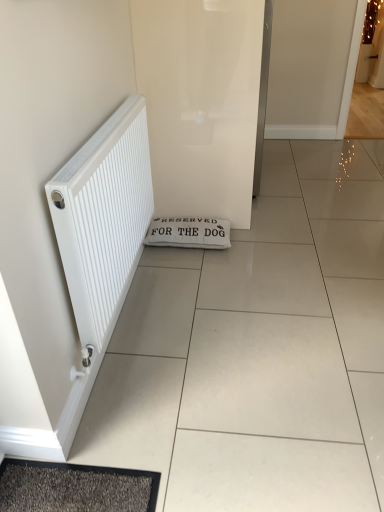
The image size is (384, 512). I want to click on white glossy screen door at center, so click(200, 102).

At what (x,y) coordinates should I click in order to perform the action: click on white glossy screen door at center. Please return your answer as a coordinate pair (x, y). Looking at the image, I should click on (200, 102).

From the picture: Which is in front, white glossy screen door at center or white matte radiator at left?

white matte radiator at left is in front.

Is white glossy screen door at center oriented towards white matte radiator at left?

No, white glossy screen door at center is not facing towards white matte radiator at left.

Can you tell me how much white glossy screen door at center and white matte radiator at left differ in facing direction?

white glossy screen door at center and white matte radiator at left are facing 0.27 degrees away from each other.

What's the angular difference between white fabric doormat at center and white matte radiator at left's facing directions?

89.7 degrees.

Is white matte radiator at left a part of white fabric doormat at center?

That's incorrect, white matte radiator at left is not inside white fabric doormat at center.

Where is `doormat behind the white matte radiator at left`? This screenshot has width=384, height=512. doormat behind the white matte radiator at left is located at coordinates tap(189, 233).

From the image's perspective, who appears lower, white matte radiator at left or white glossy screen door at center?

white matte radiator at left.

Is white matte radiator at left positioned beyond the bounds of white glossy screen door at center?

white matte radiator at left lies outside white glossy screen door at center's area.

What's the angular difference between white matte radiator at left and white glossy screen door at center's facing directions?

There is a 0.27-degree angle between the facing directions of white matte radiator at left and white glossy screen door at center.

Is white matte radiator at left directly adjacent to white glossy screen door at center?

No, white matte radiator at left is not with white glossy screen door at center.

Does white glossy screen door at center have a greater height compared to white fabric doormat at center?

Correct, white glossy screen door at center is much taller as white fabric doormat at center.

Would you say white glossy screen door at center is a long distance from white fabric doormat at center?

white glossy screen door at center is near white fabric doormat at center, not far away.

Can you tell me how much white glossy screen door at center and white fabric doormat at center differ in facing direction?

The facing directions of white glossy screen door at center and white fabric doormat at center are 89.9 degrees apart.

Which is behind, white matte radiator at left or white fabric doormat at center?

white fabric doormat at center is further away from the camera.

From the image's perspective, who appears lower, white matte radiator at left or white fabric doormat at center?

From the image's view, white fabric doormat at center is below.

Image resolution: width=384 pixels, height=512 pixels. Identify the location of doormat below the white matte radiator at left (from the image's perspective). (189, 233).

Considering their positions, is white fabric doormat at center located in front of or behind white glossy screen door at center?

white fabric doormat at center is behind white glossy screen door at center.

From the picture: Can you confirm if white fabric doormat at center is bigger than white glossy screen door at center?

No, white fabric doormat at center is not bigger than white glossy screen door at center.

How many degrees apart are the facing directions of white fabric doormat at center and white glossy screen door at center?

They differ by 89.9 degrees in their facing directions.

From the image's perspective, which is above, white fabric doormat at center or white glossy screen door at center?

white glossy screen door at center, from the image's perspective.

You are a GUI agent. You are given a task and a screenshot of the screen. Output one action in this format:
    pyautogui.click(x=<x>, y=<y>)
    Task: Click on the screen door above the white matte radiator at left (from the image's perspective)
    The image size is (384, 512).
    Given the screenshot: What is the action you would take?
    (200, 102)

Identify the location of doormat lying behind the white matte radiator at left. (189, 233).

Which object lies nearer to the anchor point white fabric doormat at center, white glossy screen door at center or white matte radiator at left?

white glossy screen door at center is positioned closer to the anchor white fabric doormat at center.

From the picture: Based on their spatial positions, is white fabric doormat at center or white glossy screen door at center further from white matte radiator at left?

The object further to white matte radiator at left is white fabric doormat at center.

Looking at the image, which one is located further to white glossy screen door at center, white matte radiator at left or white fabric doormat at center?

Based on the image, white matte radiator at left appears to be further to white glossy screen door at center.

Based on their spatial positions, is white fabric doormat at center or white matte radiator at left closer to white glossy screen door at center?

white fabric doormat at center is closer to white glossy screen door at center.

Based on their spatial positions, is white glossy screen door at center or white fabric doormat at center further from white matte radiator at left?

Based on the image, white fabric doormat at center appears to be further to white matte radiator at left.

From the image, which object appears to be nearer to white fabric doormat at center, white matte radiator at left or white glossy screen door at center?

white glossy screen door at center is closer to white fabric doormat at center.

You are a GUI agent. You are given a task and a screenshot of the screen. Output one action in this format:
    pyautogui.click(x=<x>, y=<y>)
    Task: Click on the screen door between white matte radiator at left and white fabric doormat at center along the z-axis
    
    Given the screenshot: What is the action you would take?
    pyautogui.click(x=200, y=102)